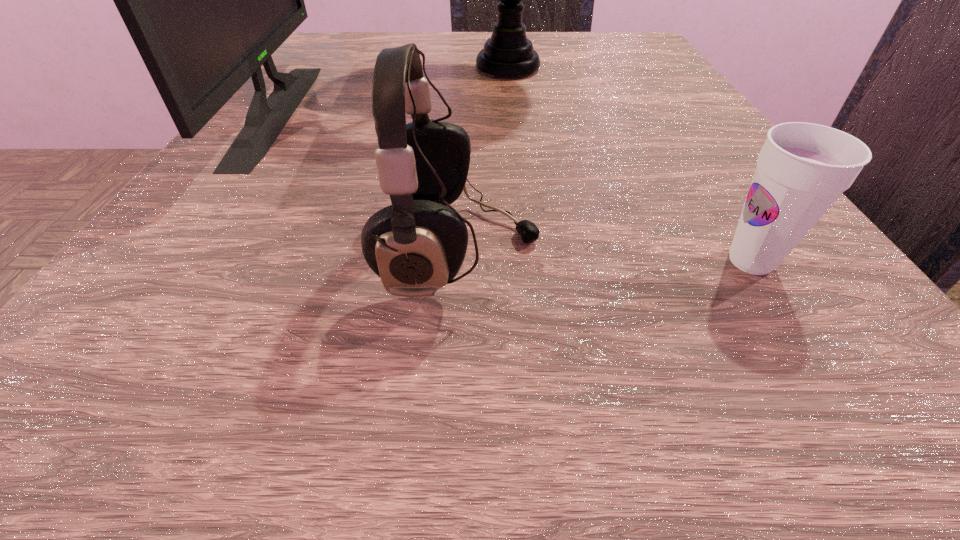
The width and height of the screenshot is (960, 540). Find the location of `free space between the tallest object and the third tallest object`. free space between the tallest object and the third tallest object is located at coordinates (485, 159).

The image size is (960, 540). What are the coordinates of `free spot between the third tallest object and the monitor` in the screenshot? It's located at (369, 181).

The height and width of the screenshot is (540, 960). What are the coordinates of `free space between the lamp and the headset` in the screenshot? It's located at (485, 159).

Choose which object is the second nearest neighbor to the tallest object. Please provide its 2D coordinates. Your answer should be formatted as a tuple, i.e. [(x, y)], where the tuple contains the x and y coordinates of a point satisfying the conditions above.

[(417, 245)]

Where is `the closest object to the second shortest object`? the closest object to the second shortest object is located at coordinates (802, 169).

The width and height of the screenshot is (960, 540). Find the location of `free location that satisfies the following two spatial constraints: 1. on the front-facing side of the monitor; 2. on the right side of the rightmost object`. free location that satisfies the following two spatial constraints: 1. on the front-facing side of the monitor; 2. on the right side of the rightmost object is located at coordinates (167, 261).

The height and width of the screenshot is (540, 960). I want to click on vacant region that satisfies the following two spatial constraints: 1. on the front side of the cup; 2. on the left side of the tallest object, so click(x=531, y=261).

This screenshot has width=960, height=540. What are the coordinates of `free location that satisfies the following two spatial constraints: 1. on the front-facing side of the monitor; 2. on the left side of the cup` in the screenshot? It's located at (167, 261).

Where is `free spot that satisfies the following two spatial constraints: 1. on the front side of the lamp; 2. on the front-facing side of the third shortest object`? free spot that satisfies the following two spatial constraints: 1. on the front side of the lamp; 2. on the front-facing side of the third shortest object is located at coordinates (513, 112).